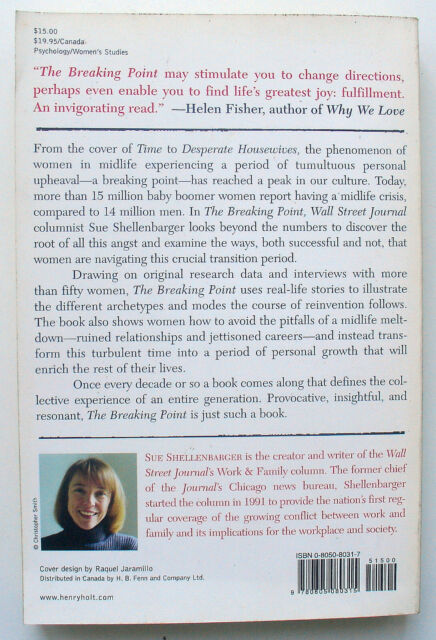
You are a GUI agent. You are given a task and a screenshot of the screen. Output one action in this format:
    pyautogui.click(x=<x>, y=<y>)
    Task: Click on the book
    
    Given the screenshot: What is the action you would take?
    pyautogui.click(x=238, y=552)